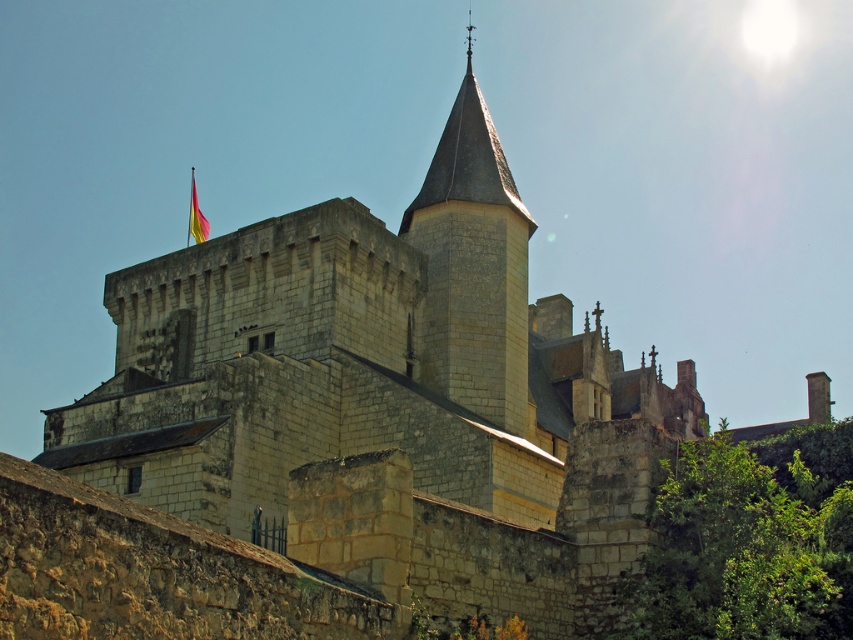
You are a tourist visiting the castle and want to take a photo that includes both the stone steeple at upper center and the silky yellow flag at upper center. Which object should you focus on first to ensure both are in frame?

You should focus on the silky yellow flag at upper center first because it is larger than the stone steeple at upper center, so it will take up more space in the frame and help ensure both are included.

You are a bird flying over the castle and want to land on the highest point between the stone steeple at upper center and the silky yellow flag at upper center. Which one should you choose?

The stone steeple at upper center has a greater height compared to the silky yellow flag at upper center, so you should choose the stone steeple at upper center to land on the highest point.